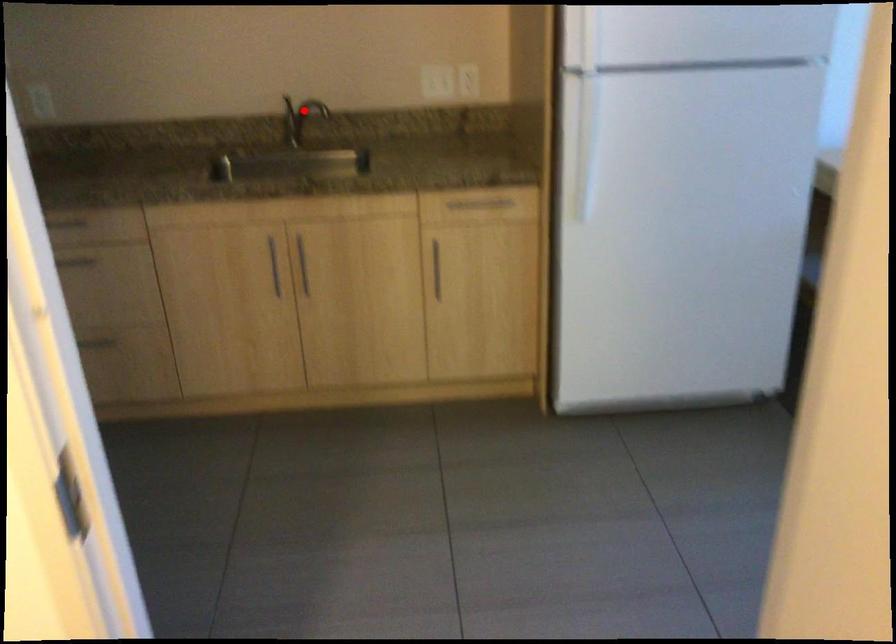
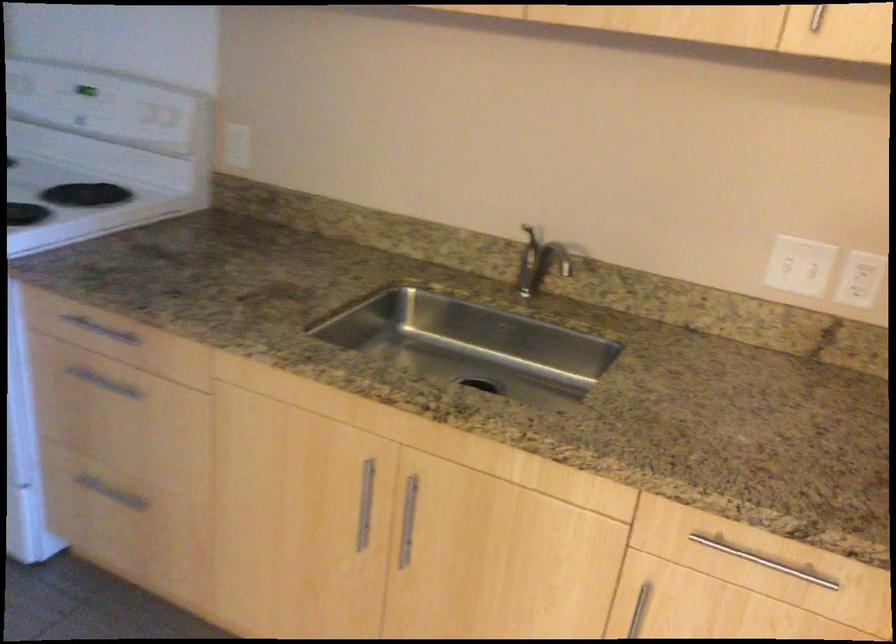
In the second image, find the point that corresponds to the highlighted location in the first image.

(545, 251)